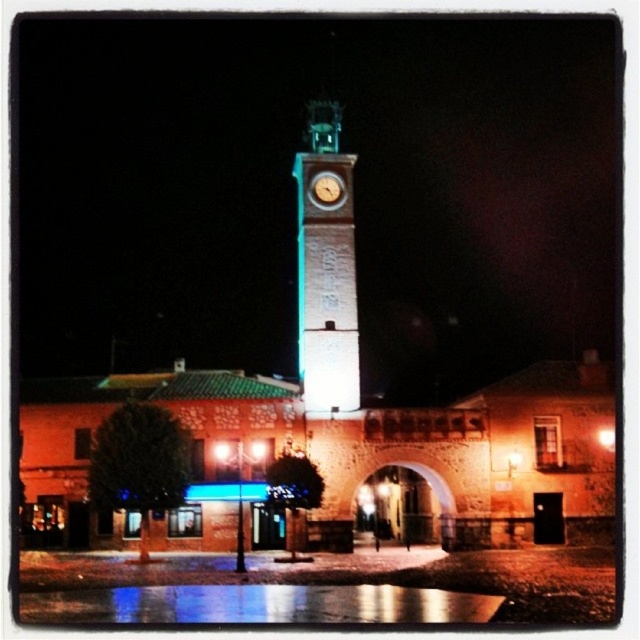
Does point (323, 381) come in front of point (308, 182)?

Yes, it is in front of point (308, 182).

Is point (339, 355) positioned in front of point (324, 198)?

That is True.

At what (x,y) coordinates should I click in order to perform the action: click on white stone clock tower at center. Please return your answer as a coordinate pair (x, y). Looking at the image, I should click on (326, 266).

Looking at this image, does white stone clock tower at center have a smaller size compared to dark stone archway at center?

No, white stone clock tower at center is not smaller than dark stone archway at center.

Does white stone clock tower at center appear on the left side of dark stone archway at center?

Yes, white stone clock tower at center is to the left of dark stone archway at center.

The width and height of the screenshot is (640, 640). What do you see at coordinates (326, 266) in the screenshot? I see `white stone clock tower at center` at bounding box center [326, 266].

Find the location of a particular element. Image resolution: width=640 pixels, height=640 pixels. white stone clock tower at center is located at coordinates (326, 266).

Which is in front, point (72, 500) or point (388, 509)?

Point (72, 500)

Does brick wall archway at center have a greater height compared to dark stone archway at center?

Correct, brick wall archway at center is much taller as dark stone archway at center.

Find the location of a particular element. brick wall archway at center is located at coordinates (x=346, y=493).